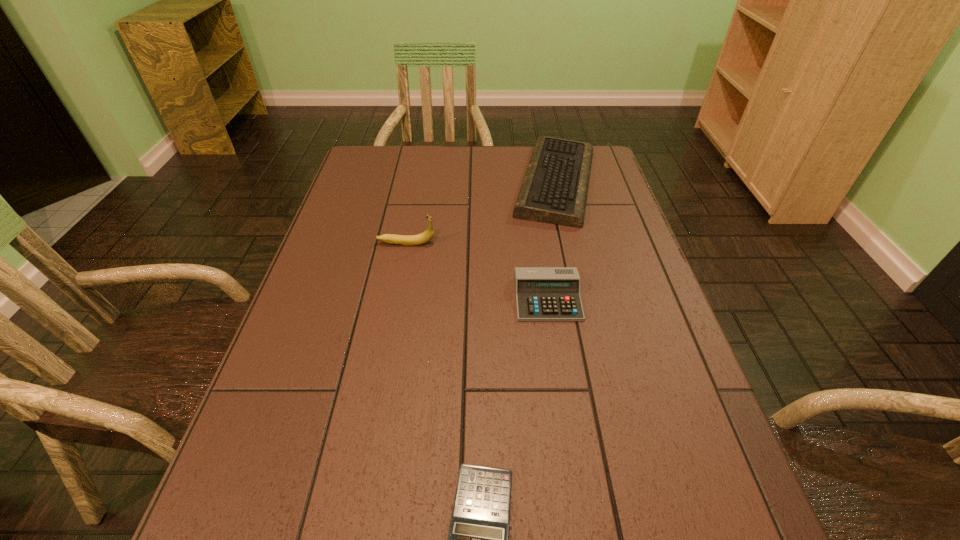
Where is `the third nearest object`? The image size is (960, 540). the third nearest object is located at coordinates (407, 240).

Find the location of `banana`. banana is located at coordinates (407, 240).

You are a GUI agent. You are given a task and a screenshot of the screen. Output one action in this format:
    pyautogui.click(x=<x>, y=<y>)
    Task: Click on the farthest object
    This screenshot has width=960, height=540.
    Given the screenshot: What is the action you would take?
    pyautogui.click(x=554, y=190)

The width and height of the screenshot is (960, 540). Identify the location of the taller calculator. (542, 293).

The image size is (960, 540). Identify the location of the second nearest object. (542, 293).

Identify the location of free point located at the stem of the third nearest object. (458, 243).

The width and height of the screenshot is (960, 540). I want to click on blank area located 0.320m on the left of the farthest object, so pyautogui.click(x=407, y=182).

Locate an element on the screen. The width and height of the screenshot is (960, 540). free space located on the left of the third farthest object is located at coordinates (486, 299).

Locate an element on the screen. object that is at the far edge is located at coordinates (554, 190).

This screenshot has width=960, height=540. What are the coordinates of `object present at the left edge` in the screenshot? It's located at pyautogui.click(x=407, y=240).